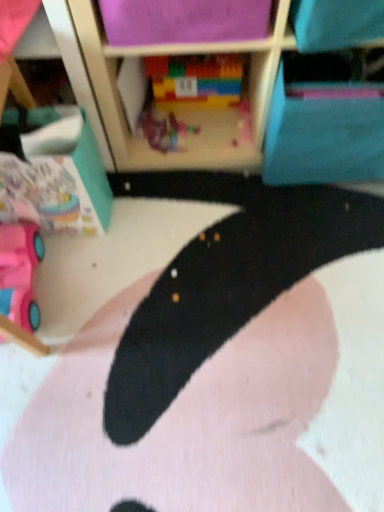
Identify the location of black matte rug at center. This screenshot has height=512, width=384. (224, 374).

This screenshot has width=384, height=512. I want to click on multicolored plastic blocks at center, placed as the first toy when sorted from top to bottom, so click(196, 79).

Where is `pink plastic toy car at lower left, marked as the first toy in a left-to-right arrangement`? pink plastic toy car at lower left, marked as the first toy in a left-to-right arrangement is located at coordinates (19, 273).

This screenshot has width=384, height=512. Describe the element at coordinates (19, 273) in the screenshot. I see `pink plastic toy car at lower left, the third toy from the top` at that location.

What is the approximate height of plastic toy at center, which is counted as the second toy, starting from the left?

plastic toy at center, which is counted as the second toy, starting from the left, is 2.19 inches tall.

Locate an element on the screen. This screenshot has height=512, width=384. blue fabric cabinet at upper right is located at coordinates (326, 119).

Identify the location of black matte rug at center. (224, 374).

Could you tell me if pink plastic toy car at lower left, positioned as the 1th toy in bottom-to-top order, is facing multicolored plastic blocks at center, which is the 3th toy from bottom to top?

No.

Which point is more forward, (27, 316) or (223, 85)?

The point (27, 316) is closer.

From a real-world perspective, is pink plastic toy car at lower left, positioned as the 1th toy in bottom-to-top order, located beneath multicolored plastic blocks at center, positioned as the third toy in left-to-right order?

Indeed, from a real-world perspective, pink plastic toy car at lower left, positioned as the 1th toy in bottom-to-top order, is positioned beneath multicolored plastic blocks at center, positioned as the third toy in left-to-right order.

Which object is further away from the camera taking this photo, pink plastic toy car at lower left, positioned as the 1th toy in bottom-to-top order, or black matte rug at center?

Positioned behind is pink plastic toy car at lower left, positioned as the 1th toy in bottom-to-top order.

Is the surface of pink plastic toy car at lower left, the 3th toy when ordered from right to left, in direct contact with black matte rug at center?

pink plastic toy car at lower left, the 3th toy when ordered from right to left, is not next to black matte rug at center, and they're not touching.

Who is shorter, pink plastic toy car at lower left, positioned as the 1th toy in bottom-to-top order, or black matte rug at center?

black matte rug at center is shorter.

Is black matte rug at center inside pink plastic toy car at lower left, the third toy from the top?

Actually, black matte rug at center is outside pink plastic toy car at lower left, the third toy from the top.

Looking at this image, does multicolored plastic blocks at center, placed as the first toy when sorted from top to bottom, have a greater height compared to pink plastic toy car at lower left, the 3th toy when ordered from right to left?

Correct, multicolored plastic blocks at center, placed as the first toy when sorted from top to bottom, is much taller as pink plastic toy car at lower left, the 3th toy when ordered from right to left.

Are multicolored plastic blocks at center, which is the 3th toy from bottom to top, and pink plastic toy car at lower left, marked as the first toy in a left-to-right arrangement, far apart?

multicolored plastic blocks at center, which is the 3th toy from bottom to top, is near pink plastic toy car at lower left, marked as the first toy in a left-to-right arrangement, not far away.

Is multicolored plastic blocks at center, the 1th toy positioned from the right, wider than pink plastic toy car at lower left, marked as the first toy in a left-to-right arrangement?

No, multicolored plastic blocks at center, the 1th toy positioned from the right, is not wider than pink plastic toy car at lower left, marked as the first toy in a left-to-right arrangement.

Which of these two, plastic toy at center, the 2th toy in the top-to-bottom sequence, or black matte rug at center, is smaller?

With smaller size is plastic toy at center, the 2th toy in the top-to-bottom sequence.

Does plastic toy at center, acting as the second toy starting from the bottom, appear on the right side of black matte rug at center?

In fact, plastic toy at center, acting as the second toy starting from the bottom, is to the left of black matte rug at center.

Do you think plastic toy at center, the 2th toy in the top-to-bottom sequence, is within black matte rug at center, or outside of it?

plastic toy at center, the 2th toy in the top-to-bottom sequence, is located beyond the bounds of black matte rug at center.

Which object is positioned more to the left, multicolored plastic blocks at center, positioned as the third toy in left-to-right order, or blue fabric cabinet at upper right?

From the viewer's perspective, multicolored plastic blocks at center, positioned as the third toy in left-to-right order, appears more on the left side.

Considering the positions of point (177, 75) and point (375, 155), is point (177, 75) closer or farther from the camera than point (375, 155)?

Point (177, 75).

Image resolution: width=384 pixels, height=512 pixels. In order to click on cabinet in front of the multicolored plastic blocks at center, which is the 3th toy from bottom to top in this screenshot , I will do `click(326, 119)`.

In the scene shown: From a real-world perspective, which object stands above the other?

blue fabric cabinet at upper right is physically above.

Who is more distant, pink plastic toy car at lower left, the 3th toy when ordered from right to left, or blue fabric cabinet at upper right?

blue fabric cabinet at upper right is behind.

Is pink plastic toy car at lower left, the 3th toy when ordered from right to left, to the right of blue fabric cabinet at upper right from the viewer's perspective?

Incorrect, pink plastic toy car at lower left, the 3th toy when ordered from right to left, is not on the right side of blue fabric cabinet at upper right.

Between multicolored plastic blocks at center, which is the 3th toy from bottom to top, and black matte rug at center, which one has more height?

multicolored plastic blocks at center, which is the 3th toy from bottom to top, is taller.

From the image's perspective, is multicolored plastic blocks at center, positioned as the third toy in left-to-right order, on black matte rug at center?

Correct, multicolored plastic blocks at center, positioned as the third toy in left-to-right order, appears higher than black matte rug at center in the image.

Consider the image. Is multicolored plastic blocks at center, positioned as the third toy in left-to-right order, facing towards black matte rug at center?

Yes, multicolored plastic blocks at center, positioned as the third toy in left-to-right order, is aimed at black matte rug at center.

Locate an element on the screen. The image size is (384, 512). toy in front of the multicolored plastic blocks at center, placed as the first toy when sorted from top to bottom is located at coordinates (19, 273).

Locate an element on the screen. The image size is (384, 512). toy that is the 2nd one above the black matte rug at center (from a real-world perspective) is located at coordinates (19, 273).

When comparing their distances from multicolored plastic blocks at center, positioned as the third toy in left-to-right order, does pink plastic toy car at lower left, positioned as the 1th toy in bottom-to-top order, or black matte rug at center seem closer?

Among the two, pink plastic toy car at lower left, positioned as the 1th toy in bottom-to-top order, is located nearer to multicolored plastic blocks at center, positioned as the third toy in left-to-right order.

Considering their positions, is pink plastic toy car at lower left, positioned as the 1th toy in bottom-to-top order, positioned further to black matte rug at center than multicolored plastic blocks at center, positioned as the third toy in left-to-right order?

multicolored plastic blocks at center, positioned as the third toy in left-to-right order, is further to black matte rug at center.

Which object lies nearer to the anchor point pink plastic toy car at lower left, the third toy from the top, blue fabric cabinet at upper right or plastic toy at center, acting as the second toy starting from the bottom?

plastic toy at center, acting as the second toy starting from the bottom.

Which object lies nearer to the anchor point multicolored plastic blocks at center, which is the 3th toy from bottom to top, pink plastic toy car at lower left, marked as the first toy in a left-to-right arrangement, or blue fabric cabinet at upper right?

A: The object closer to multicolored plastic blocks at center, which is the 3th toy from bottom to top, is blue fabric cabinet at upper right.

When comparing their distances from black matte rug at center, does blue fabric cabinet at upper right or multicolored plastic blocks at center, which is the 3th toy from bottom to top, seem closer?

The object closer to black matte rug at center is blue fabric cabinet at upper right.

Based on their spatial positions, is plastic toy at center, the second toy viewed from the right, or pink plastic toy car at lower left, positioned as the 1th toy in bottom-to-top order, closer to blue fabric cabinet at upper right?

The object closer to blue fabric cabinet at upper right is plastic toy at center, the second toy viewed from the right.

Considering their positions, is multicolored plastic blocks at center, which is the 3th toy from bottom to top, positioned closer to plastic toy at center, the 2th toy in the top-to-bottom sequence, than blue fabric cabinet at upper right?

The object closer to plastic toy at center, the 2th toy in the top-to-bottom sequence, is multicolored plastic blocks at center, which is the 3th toy from bottom to top.

Based on their spatial positions, is plastic toy at center, which is counted as the second toy, starting from the left, or blue fabric cabinet at upper right closer to multicolored plastic blocks at center, the 1th toy positioned from the right?

The object closer to multicolored plastic blocks at center, the 1th toy positioned from the right, is plastic toy at center, which is counted as the second toy, starting from the left.

The image size is (384, 512). What are the coordinates of `toy between multicolored plastic blocks at center, the 1th toy positioned from the right, and black matte rug at center from top to bottom` in the screenshot? It's located at (164, 131).

This screenshot has width=384, height=512. I want to click on cabinet between multicolored plastic blocks at center, which is the 3th toy from bottom to top, and black matte rug at center vertically, so click(x=326, y=119).

Locate an element on the screen. The image size is (384, 512). toy between multicolored plastic blocks at center, the 1th toy positioned from the right, and pink plastic toy car at lower left, marked as the first toy in a left-to-right arrangement, vertically is located at coordinates (164, 131).

This screenshot has height=512, width=384. In order to click on animal between multicolored plastic blocks at center, positioned as the third toy in left-to-right order, and pink plastic toy car at lower left, marked as the first toy in a left-to-right arrangement, in the up-down direction in this screenshot , I will do `click(224, 374)`.